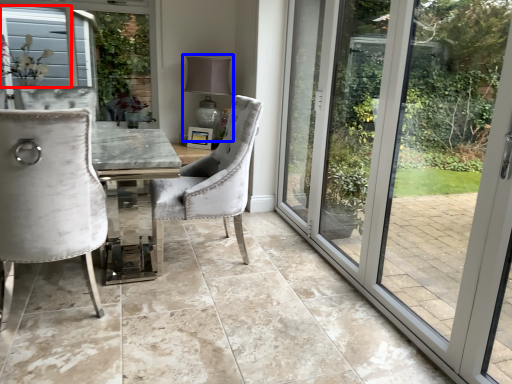
Question: Which of the following is the closest to the observer, window screen (highlighted by a red box) or lamp (highlighted by a blue box)?

Choices:
 (A) window screen
 (B) lamp

Answer: (A)